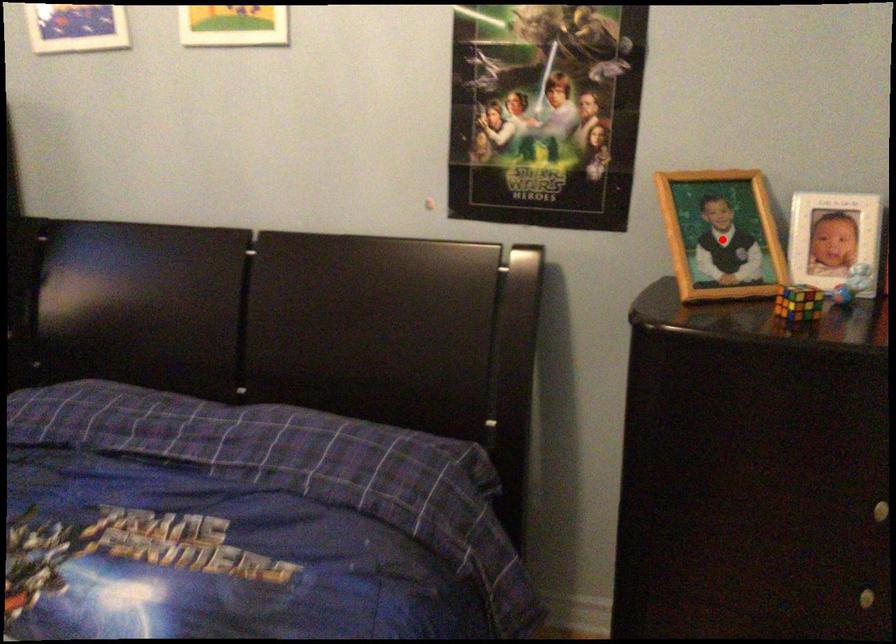
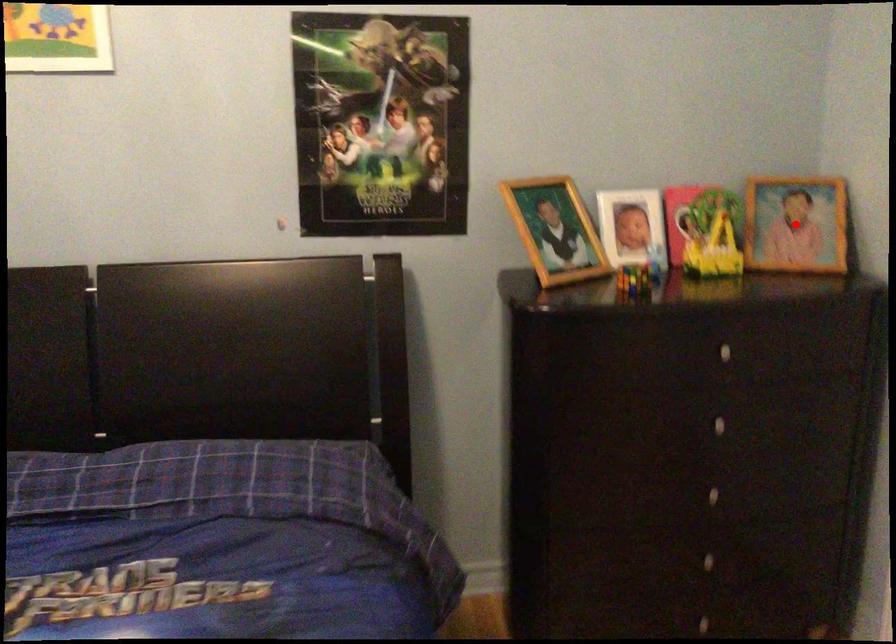
I am providing you with two images of the same scene from different viewpoints. A red point is marked on the first image and another point is marked on the second image. Is the marked point in image1 the same physical position as the marked point in image2?

No